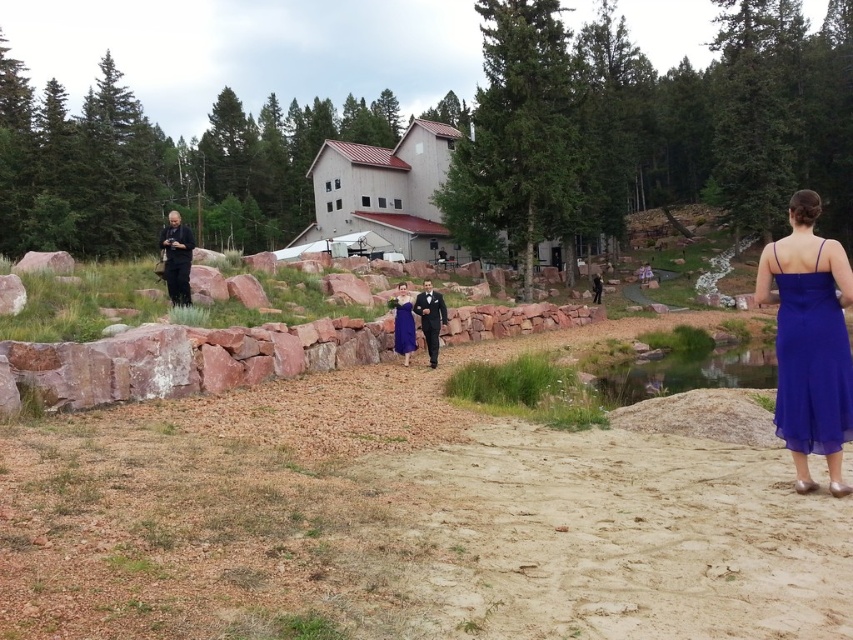
Question: Is clear water at center further to camera compared to shiny black suit at center?

Choices:
 (A) no
 (B) yes

Answer: (A)

Question: In this image, where is dark blue uniform at left located relative to royal blue chiffon dress at center?

Choices:
 (A) right
 (B) left

Answer: (B)

Question: Which point is farther to the camera?

Choices:
 (A) royal blue chiffon dress at right
 (B) shiny black suit at center
 (C) royal blue chiffon dress at center

Answer: (C)

Question: Is clear water at center below royal blue chiffon dress at center?

Choices:
 (A) yes
 (B) no

Answer: (A)

Question: Among these objects, which one is nearest to the camera?

Choices:
 (A) clear water at center
 (B) royal blue chiffon dress at center
 (C) shiny black suit at center

Answer: (A)

Question: Considering the real-world distances, which object is closest to the clear water at center?

Choices:
 (A) shiny black suit at center
 (B) royal blue chiffon dress at right
 (C) royal blue chiffon dress at center
 (D) dark blue uniform at left

Answer: (C)